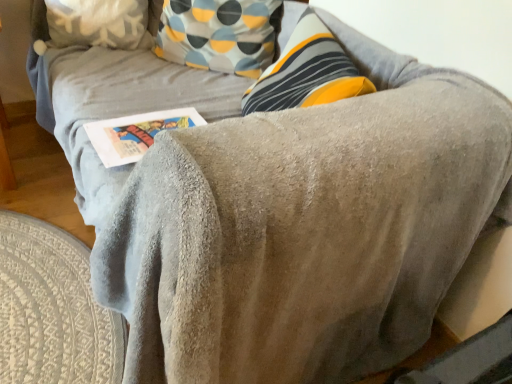
Question: Is white paper at center taller than fluffy white pillow at upper left?

Choices:
 (A) no
 (B) yes

Answer: (A)

Question: Could fluffy white pillow at upper left be considered to be inside white paper at center?

Choices:
 (A) yes
 (B) no

Answer: (B)

Question: From the image's perspective, does white paper at center appear higher than fluffy white pillow at upper left?

Choices:
 (A) yes
 (B) no

Answer: (B)

Question: Is white paper at center at the left side of fluffy white pillow at upper left?

Choices:
 (A) no
 (B) yes

Answer: (A)

Question: Is white paper at center looking in the opposite direction of fluffy white pillow at upper left?

Choices:
 (A) yes
 (B) no

Answer: (B)

Question: Is white paper at center thinner than fluffy white pillow at upper left?

Choices:
 (A) yes
 (B) no

Answer: (B)

Question: Is fluffy white pillow at upper left touching white paper at center?

Choices:
 (A) no
 (B) yes

Answer: (A)

Question: Considering the relative sizes of fluffy white pillow at upper left and white paper at center in the image provided, is fluffy white pillow at upper left thinner than white paper at center?

Choices:
 (A) no
 (B) yes

Answer: (B)

Question: Are fluffy white pillow at upper left and white paper at center located far from each other?

Choices:
 (A) no
 (B) yes

Answer: (A)

Question: From the image's perspective, is fluffy white pillow at upper left below white paper at center?

Choices:
 (A) yes
 (B) no

Answer: (B)

Question: Is fluffy white pillow at upper left taller than white paper at center?

Choices:
 (A) no
 (B) yes

Answer: (B)

Question: Is fluffy white pillow at upper left at the right side of white paper at center?

Choices:
 (A) yes
 (B) no

Answer: (B)

Question: Considering their positions, is fluffy white pillow at upper left located in front of or behind white paper at center?

Choices:
 (A) front
 (B) behind

Answer: (B)